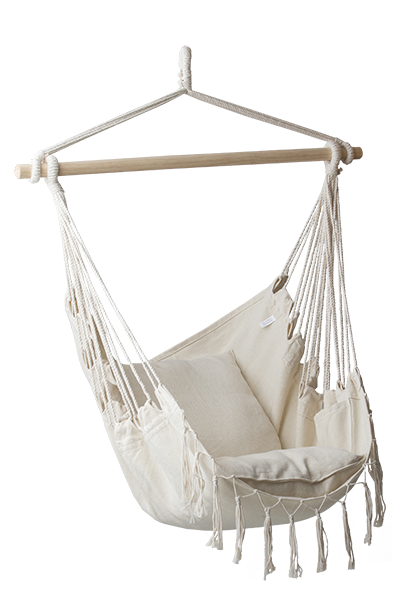
The height and width of the screenshot is (600, 400). Identify the location of wooden support bar. (192, 152).